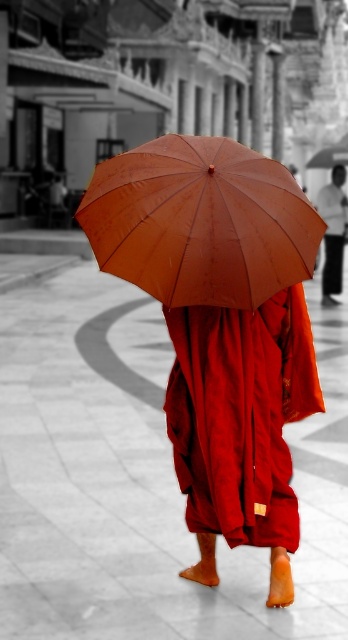
Does white tile pavement at center appear on the left side of brown matte umbrella at center?

Incorrect, white tile pavement at center is not on the left side of brown matte umbrella at center.

Between white tile pavement at center and brown matte umbrella at center, which one appears on the right side from the viewer's perspective?

From the viewer's perspective, white tile pavement at center appears more on the right side.

Image resolution: width=348 pixels, height=640 pixels. What do you see at coordinates (141, 480) in the screenshot?
I see `white tile pavement at center` at bounding box center [141, 480].

Where is `white tile pavement at center`? The width and height of the screenshot is (348, 640). white tile pavement at center is located at coordinates (141, 480).

Between white tile pavement at center and matte red robe at center, which one is positioned lower?

matte red robe at center is lower down.

Between point (337, 504) and point (294, 508), which one is positioned in front?

Positioned in front is point (294, 508).

This screenshot has width=348, height=640. In order to click on white tile pavement at center in this screenshot , I will do `click(141, 480)`.

Does point (263, 244) come behind point (328, 280)?

No, (263, 244) is in front of (328, 280).

Can you confirm if brown matte umbrella at center is taller than matte orange umbrella at center?

Incorrect, brown matte umbrella at center's height is not larger of matte orange umbrella at center's.

Where is `brown matte umbrella at center`? Image resolution: width=348 pixels, height=640 pixels. brown matte umbrella at center is located at coordinates (200, 221).